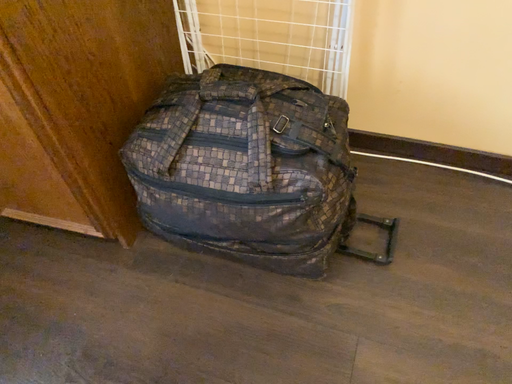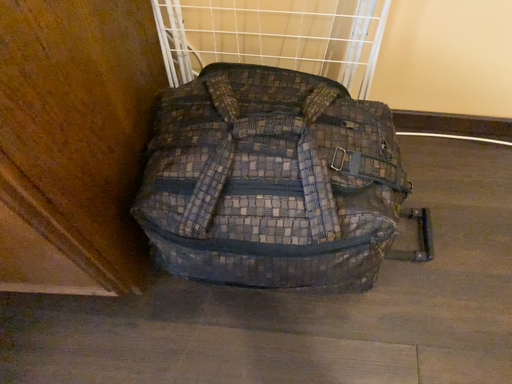
Question: Which way did the camera rotate in the video?

Choices:
 (A) rotated upward
 (B) rotated downward

Answer: (B)